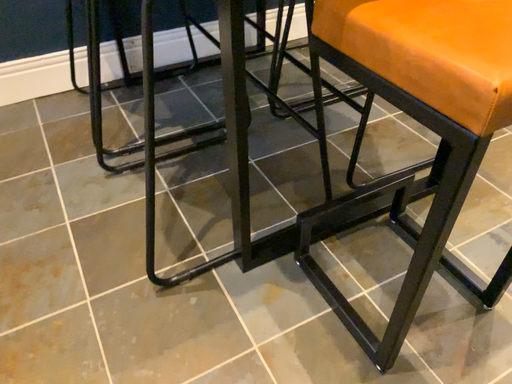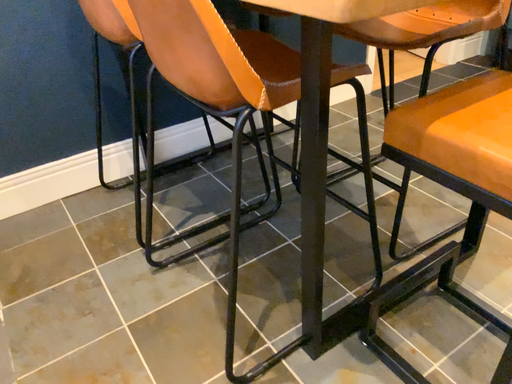
Question: How did the camera likely rotate when shooting the video?

Choices:
 (A) rotated upward
 (B) rotated downward

Answer: (A)